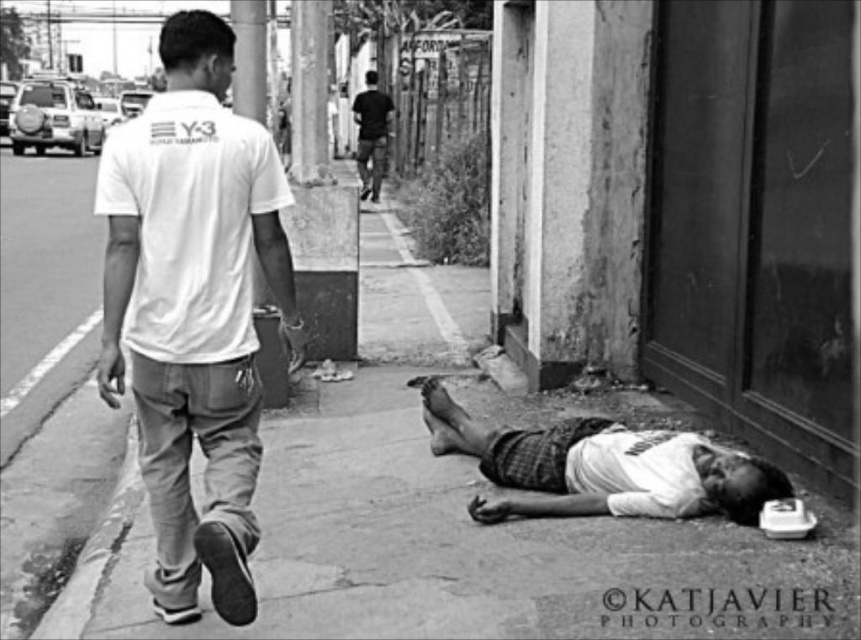
Which is more to the right, white cotton t-shirt at center or white cotton shirt at lower right?

white cotton shirt at lower right

Is white cotton t-shirt at center to the right of white cotton shirt at lower right from the viewer's perspective?

In fact, white cotton t-shirt at center is to the left of white cotton shirt at lower right.

The width and height of the screenshot is (861, 640). Describe the element at coordinates (193, 308) in the screenshot. I see `white cotton t-shirt at center` at that location.

The height and width of the screenshot is (640, 861). In order to click on white cotton t-shirt at center in this screenshot , I will do `click(193, 308)`.

Between white cotton shirt at lower right and dark clothing figure at center, which one appears on the left side from the viewer's perspective?

From the viewer's perspective, dark clothing figure at center appears more on the left side.

Does white cotton shirt at lower right have a lesser width compared to dark clothing figure at center?

No.

Locate an element on the screen. The height and width of the screenshot is (640, 861). white cotton shirt at lower right is located at coordinates click(601, 467).

Is white cotton t-shirt at center bigger than dark clothing figure at center?

No, white cotton t-shirt at center is not bigger than dark clothing figure at center.

The height and width of the screenshot is (640, 861). Find the location of `white cotton t-shirt at center`. white cotton t-shirt at center is located at coordinates (193, 308).

Who is more forward, (243, 333) or (375, 195)?

Point (243, 333)

I want to click on white cotton t-shirt at center, so click(193, 308).